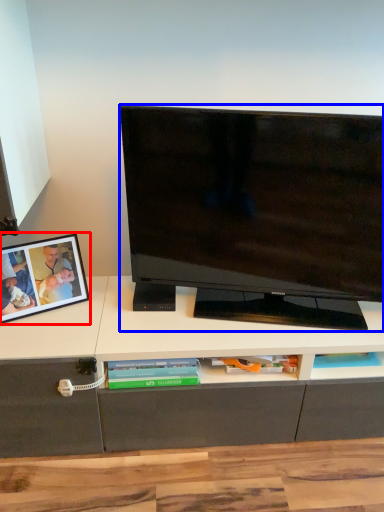
Question: Which object appears farthest to the camera in this image, picture frame (highlighted by a red box) or television (highlighted by a blue box)?

Choices:
 (A) picture frame
 (B) television

Answer: (A)